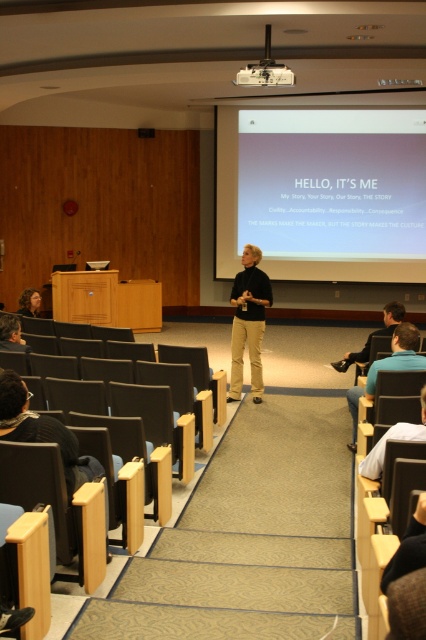
In the scene shown: Who is taller, white plastic projector at upper center or dark brown hair at lower left?

dark brown hair at lower left is taller.

Is white plastic projector at upper center shorter than dark brown hair at lower left?

Correct, white plastic projector at upper center is not as tall as dark brown hair at lower left.

Where is `white plastic projector at upper center`? white plastic projector at upper center is located at coordinates (264, 74).

Is matte white projector screen at upper center positioned in front of dark brown hair at lower left?

No, matte white projector screen at upper center is further to the viewer.

What do you see at coordinates (322, 193) in the screenshot? Image resolution: width=426 pixels, height=640 pixels. I see `matte white projector screen at upper center` at bounding box center [322, 193].

Does point (374, 253) come behind point (25, 301)?

Yes.

Identify the location of matte white projector screen at upper center. Image resolution: width=426 pixels, height=640 pixels. (322, 193).

Can you confirm if blue fabric shirt at lower right is shorter than dark brown hair at lower left?

No, blue fabric shirt at lower right is not shorter than dark brown hair at lower left.

The height and width of the screenshot is (640, 426). Describe the element at coordinates (388, 368) in the screenshot. I see `blue fabric shirt at lower right` at that location.

Which is in front, point (402, 356) or point (39, 308)?

Point (402, 356) is more forward.

Find the location of a particular element. This screenshot has width=426, height=640. blue fabric shirt at lower right is located at coordinates (388, 368).